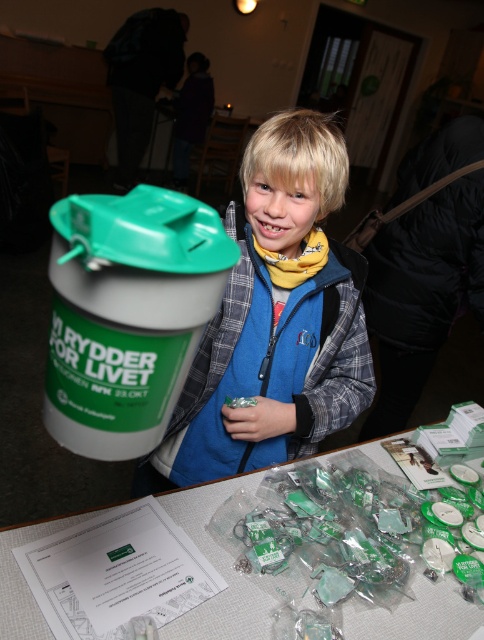
Question: Among these points, which one is farthest from the camera?

Choices:
 (A) [25, 586]
 (B) [262, 125]

Answer: (B)

Question: Can you confirm if blue fleece jacket at center is smaller than translucent plastic table at center?

Choices:
 (A) yes
 (B) no

Answer: (B)

Question: Which point is farther to the camera?

Choices:
 (A) [x=183, y=513]
 (B) [x=239, y=209]

Answer: (B)

Question: Is the position of blue fleece jacket at center more distant than that of translucent plastic table at center?

Choices:
 (A) yes
 (B) no

Answer: (A)

Question: Can you confirm if blue fleece jacket at center is positioned to the left of translucent plastic table at center?

Choices:
 (A) no
 (B) yes

Answer: (B)